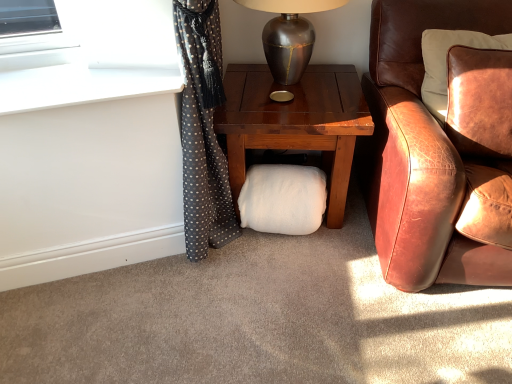
Find the location of a particular element. free space in front of white fluffy pillow at center is located at coordinates (287, 273).